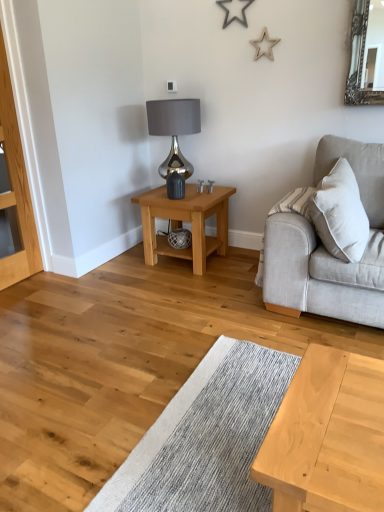
Locate an element on the screen. This screenshot has width=384, height=512. vacant space to the right of light oak dresser at left is located at coordinates (50, 286).